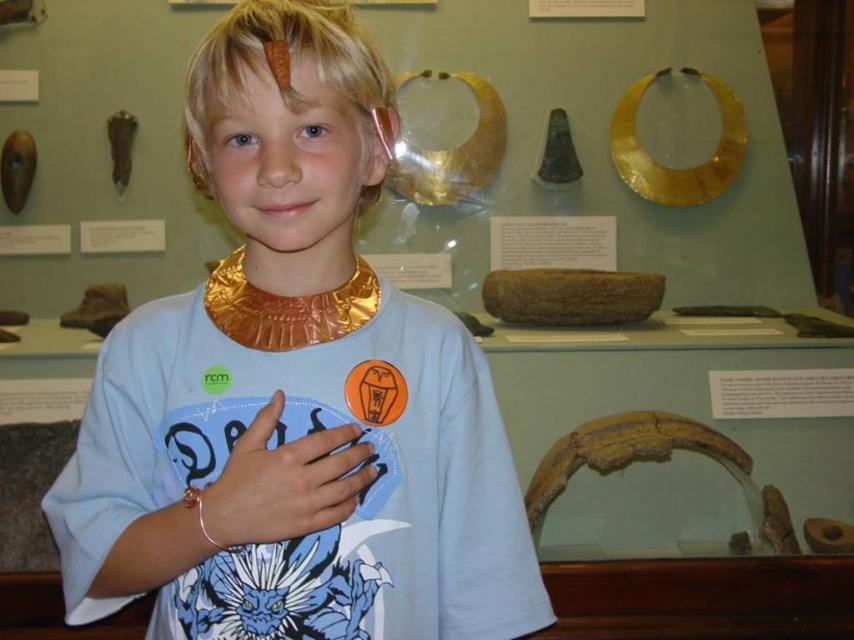
Question: Can you confirm if matte gold necklace at center is positioned below matte gold bracelet at center?

Choices:
 (A) no
 (B) yes

Answer: (A)

Question: Which point appears closest to the camera in this image?

Choices:
 (A) (343, 476)
 (B) (334, 102)

Answer: (B)

Question: Can you confirm if matte gold necklace at center is positioned below matte gold bracelet at center?

Choices:
 (A) no
 (B) yes

Answer: (A)

Question: Is matte gold necklace at center smaller than matte gold bracelet at center?

Choices:
 (A) no
 (B) yes

Answer: (A)

Question: Which of the following is the closest to the observer?

Choices:
 (A) matte gold bracelet at center
 (B) matte gold necklace at center

Answer: (B)

Question: Among these objects, which one is nearest to the camera?

Choices:
 (A) matte gold bracelet at center
 (B) matte gold necklace at center

Answer: (B)